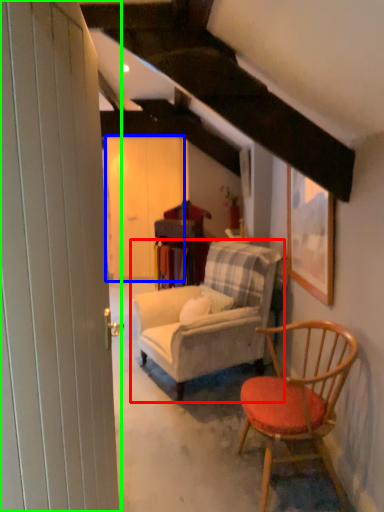
Question: Which is nearer to the studio couch (highlighted by a red box)? barn door (highlighted by a blue box) or barn door (highlighted by a green box).

Choices:
 (A) barn door
 (B) barn door

Answer: (B)